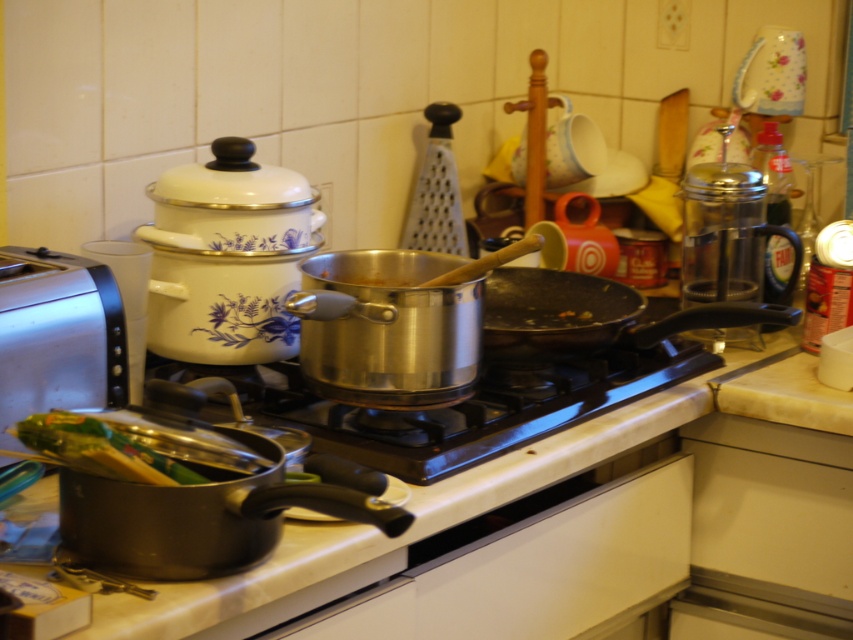
You are a chef preparing dinner and need to place the silver metallic toaster at left on a higher shelf in the kitchen. Can you determine if the stainless steel gas stove at center is positioned below it?

The stainless steel gas stove at center is located below the silver metallic toaster at left, so yes, the stove is positioned below the toaster.